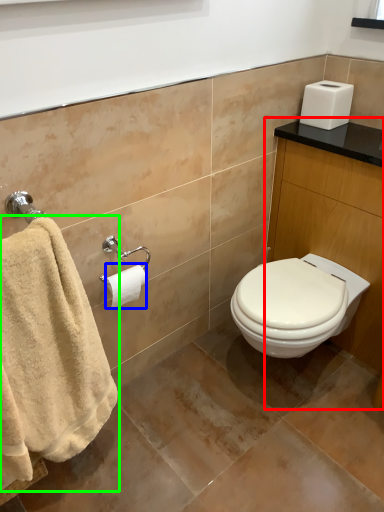
Question: Which object is positioned closest to vanity (highlighted by a red box)? Select from toilet paper (highlighted by a blue box) and towel (highlighted by a green box).

Choices:
 (A) toilet paper
 (B) towel

Answer: (A)